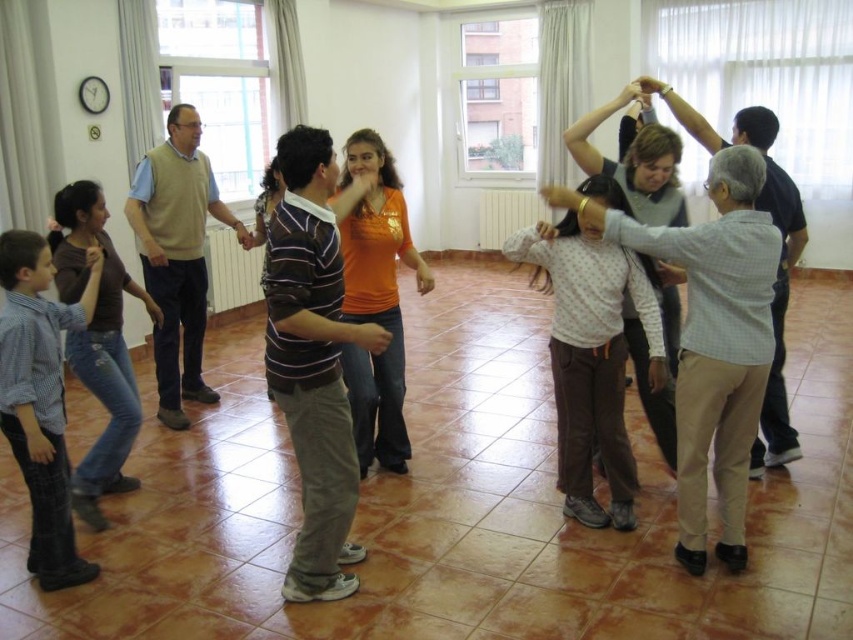
Question: Which of the following is the farthest from the observer?

Choices:
 (A) (190, 328)
 (B) (769, 438)

Answer: (A)

Question: Can you confirm if beige sweater at center is smaller than checkered fabric shirt at upper right?

Choices:
 (A) yes
 (B) no

Answer: (B)

Question: Does beige sweater at center appear on the right side of checkered fabric shirt at upper right?

Choices:
 (A) yes
 (B) no

Answer: (B)

Question: Does beige sweater at center appear on the right side of checkered fabric shirt at upper right?

Choices:
 (A) yes
 (B) no

Answer: (B)

Question: Which of the following is the farthest from the observer?

Choices:
 (A) (756, 106)
 (B) (218, 193)

Answer: (A)